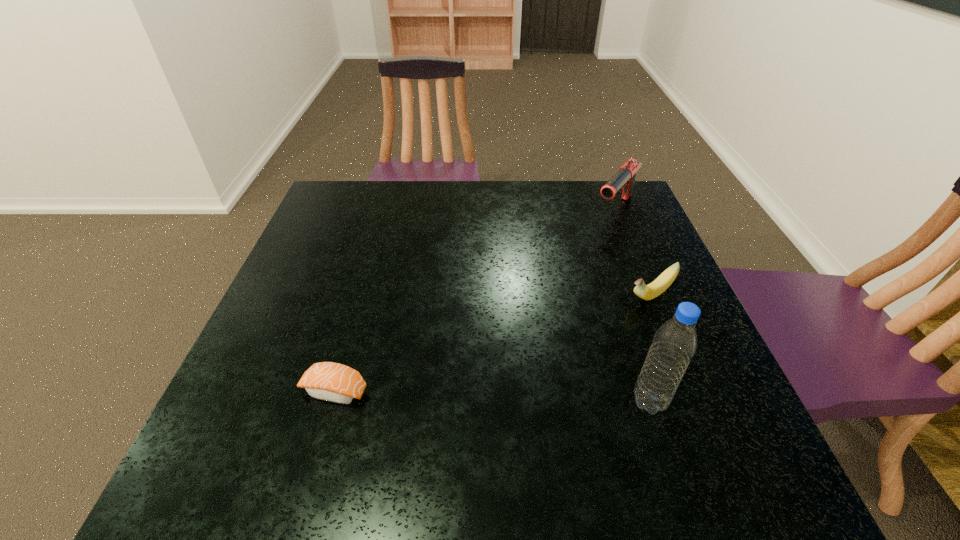
The width and height of the screenshot is (960, 540). I want to click on sushi, so click(x=329, y=381).

The height and width of the screenshot is (540, 960). I want to click on the leftmost object, so click(329, 381).

Where is `water bottle`? water bottle is located at coordinates (675, 342).

Image resolution: width=960 pixels, height=540 pixels. In order to click on the third nearest object in this screenshot , I will do `click(647, 292)`.

Find the location of `banana`. banana is located at coordinates (647, 292).

You are a GUI agent. You are given a task and a screenshot of the screen. Output one action in this format:
    pyautogui.click(x=<x>, y=<y>)
    Task: Click on the farthest object
    
    Given the screenshot: What is the action you would take?
    pyautogui.click(x=624, y=179)

Identify the location of the second tallest object. (x=624, y=179).

This screenshot has height=540, width=960. I want to click on free space located 0.080m on the right of the shortest object, so click(x=410, y=390).

Locate an element on the screen. free location located on the left of the water bottle is located at coordinates (504, 402).

The image size is (960, 540). What are the coordinates of `free region located 0.220m at the stem of the second farthest object` in the screenshot? It's located at (566, 357).